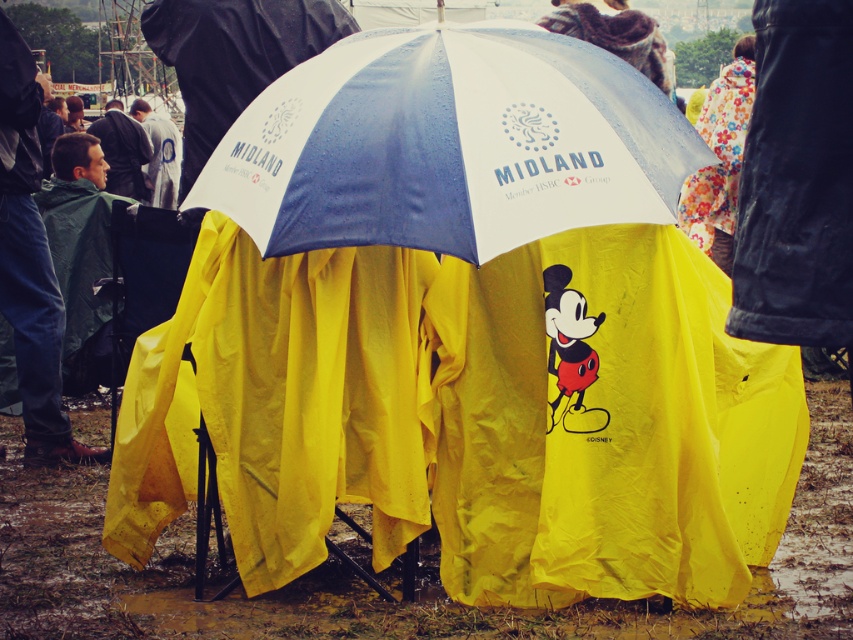
You are standing at the origin point of the coordinate system. You want to move towards the whiteumbrella at center. What direction should you move in?

Since the whiteumbrella at center is located at coordinate point (450, 145), you should move northeast to reach it.